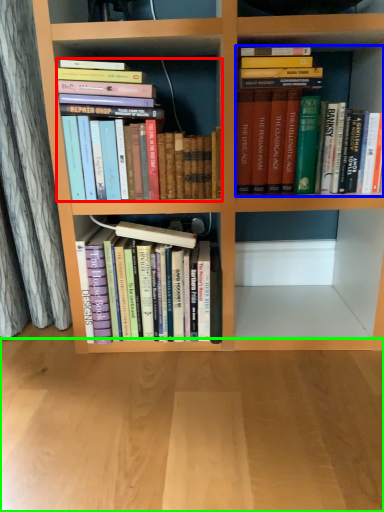
Question: Based on their relative distances, which object is nearer to book (highlighted by a red box)? Choose from book (highlighted by a blue box) and plain (highlighted by a green box).

Choices:
 (A) book
 (B) plain

Answer: (A)